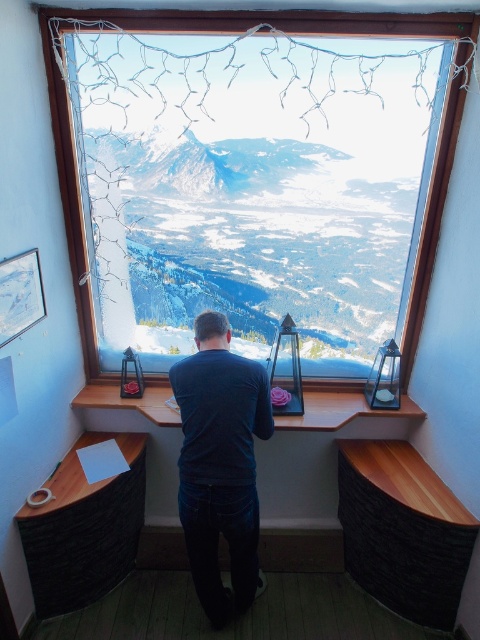
Does transparent glass window at center have a larger size compared to wooden desk at lower left?

Indeed, transparent glass window at center has a larger size compared to wooden desk at lower left.

Who is more distant from viewer, [63,141] or [41,529]?

Point [63,141]

Find the location of `transparent glass window at center`. transparent glass window at center is located at coordinates (193, 29).

Which is in front, point (222, 220) or point (83, 566)?

Point (83, 566)

Looking at this image, does snowy mountain at upper center have a lesser height compared to wooden desk at lower left?

Incorrect, snowy mountain at upper center's height does not fall short of wooden desk at lower left's.

Who is more forward, (232, 154) or (68, 586)?

Point (68, 586)

This screenshot has width=480, height=640. In order to click on snowy mountain at upper center in this screenshot , I will do `click(248, 243)`.

Is snowy mountain at upper center closer to camera compared to wooden at lower right?

That is False.

Is point (348, 262) farther from viewer compared to point (356, 499)?

Yes, point (348, 262) is behind point (356, 499).

You are a GUI agent. You are given a task and a screenshot of the screen. Output one action in this format:
    pyautogui.click(x=<x>, y=<y>)
    Task: Click on the snowy mountain at upper center
    
    Given the screenshot: What is the action you would take?
    pyautogui.click(x=248, y=243)